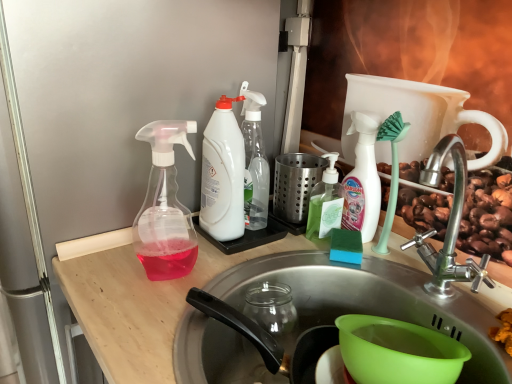
Identify the location of vacant area in front of white plastic bottle at center, arranged as the 2th bottle when viewed from the left. (202, 263).